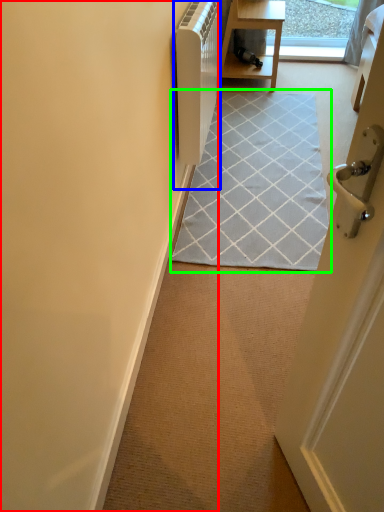
Question: Which is nearer to the door (highlighted by a red box)? appliance (highlighted by a blue box) or doormat (highlighted by a green box).

Choices:
 (A) appliance
 (B) doormat

Answer: (A)